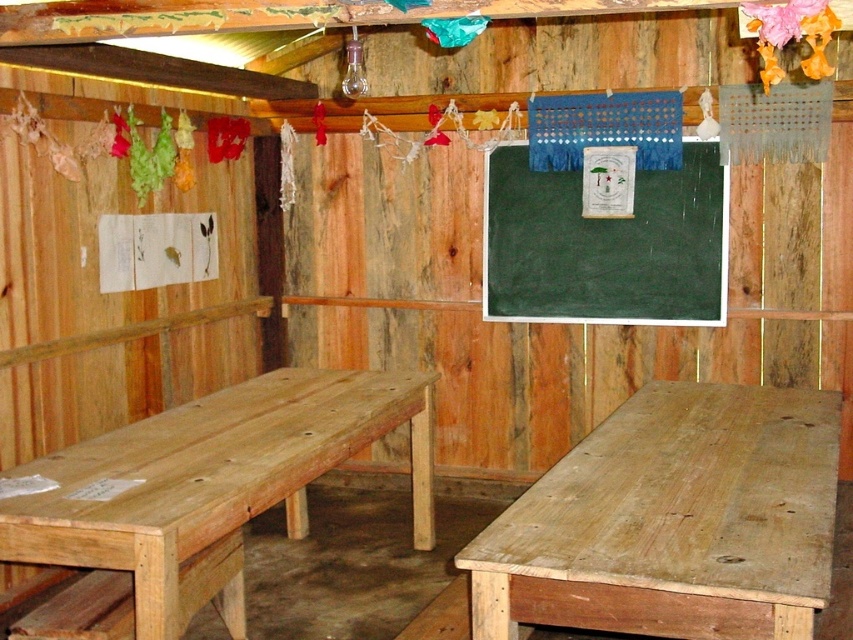
Is point (689, 257) closer to viewer compared to point (229, 579)?

No, (689, 257) is behind (229, 579).

Is point (692, 147) more distant than point (238, 634)?

Yes.

This screenshot has height=640, width=853. I want to click on green matte/blackboard at upper center, so click(605, 244).

Is natural wood picnic table at left positioned behind natural wood bench at lower left?

No, natural wood picnic table at left is in front of natural wood bench at lower left.

Locate an element on the screen. The height and width of the screenshot is (640, 853). natural wood picnic table at left is located at coordinates (207, 488).

Does wooden table at lower right have a lesser width compared to natural wood picnic table at left?

No.

Is point (727, 476) farther from viewer compared to point (152, 540)?

That is True.

Between point (660, 456) and point (416, 476), which one is positioned in front?

Positioned in front is point (660, 456).

Where is `wooden table at lower right`? The image size is (853, 640). wooden table at lower right is located at coordinates (672, 520).